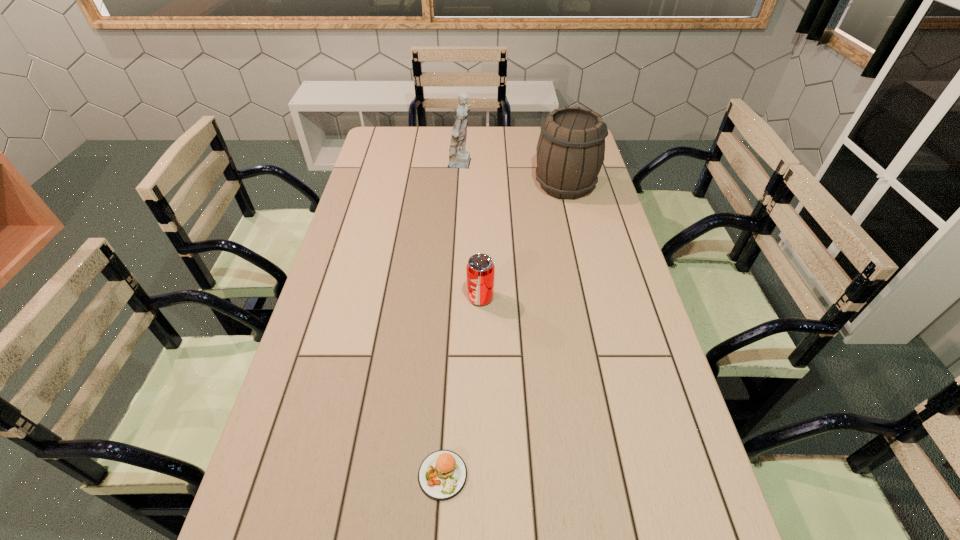
You are a GUI agent. You are given a task and a screenshot of the screen. Output one action in this format:
    pyautogui.click(x=<x>, y=<y>)
    Task: Click on the figurine
    Image resolution: width=960 pixels, height=540 pixels.
    Given the screenshot: What is the action you would take?
    pyautogui.click(x=458, y=157)

Where is `the rightmost object`? The height and width of the screenshot is (540, 960). the rightmost object is located at coordinates (571, 148).

Find the location of a particular element. the second shortest object is located at coordinates (480, 269).

What are the coordinates of `the third farthest object` in the screenshot? It's located at (480, 269).

What are the coordinates of `the nearest object` in the screenshot? It's located at (442, 475).

Where is `the shortest object`? This screenshot has height=540, width=960. the shortest object is located at coordinates (442, 475).

At what (x,y) coordinates should I click in order to perform the action: click on free region located on the front-facing side of the figurine. Please return your answer as a coordinate pair (x, y). Looking at the image, I should click on (495, 165).

The width and height of the screenshot is (960, 540). What are the coordinates of `vacant position located 0.080m on the front of the wine bucket` in the screenshot? It's located at (572, 218).

Where is `vacant space situated on the front of the third tallest object`? Image resolution: width=960 pixels, height=540 pixels. vacant space situated on the front of the third tallest object is located at coordinates (481, 421).

The height and width of the screenshot is (540, 960). I want to click on free location located on the right of the patty, so click(633, 475).